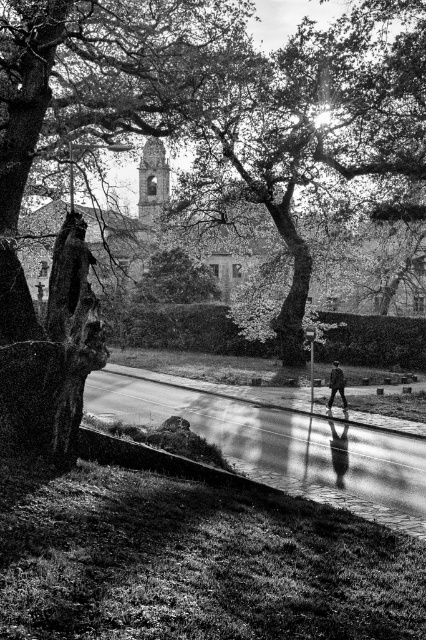
From the picture: You are standing on the paved pathway in the scene and want to take a photo of both the smooth bark tree at center and the smooth bark tree at upper center. Which tree should you position yourself closer to in order to include both in your camera frame?

To include both the smooth bark tree at center and the smooth bark tree at upper center in your camera frame, you should position yourself closer to the smooth bark tree at center since it is located to the left of the smooth bark tree at upper center.

You are a photographer standing on the smooth asphalt pavement at center. You want to take a photo of the dark gray fabric jacket at center. Since you can only focus on one object at a time, which object should you adjust your camera to focus on first if you want to ensure the jacket is in the frame?

The smooth asphalt pavement at center is wider than the dark gray fabric jacket at center, so you should focus on the jacket first as it is smaller and needs precise framing.

You are a photographer standing at the edge of the smooth asphalt pavement at center and want to take a picture of the dark gray fabric jacket at center. Which direction should you move to frame the jacket properly?

You should move to your right because the smooth asphalt pavement at center is to the left of the dark gray fabric jacket at center, so moving right will align the jacket in the frame.